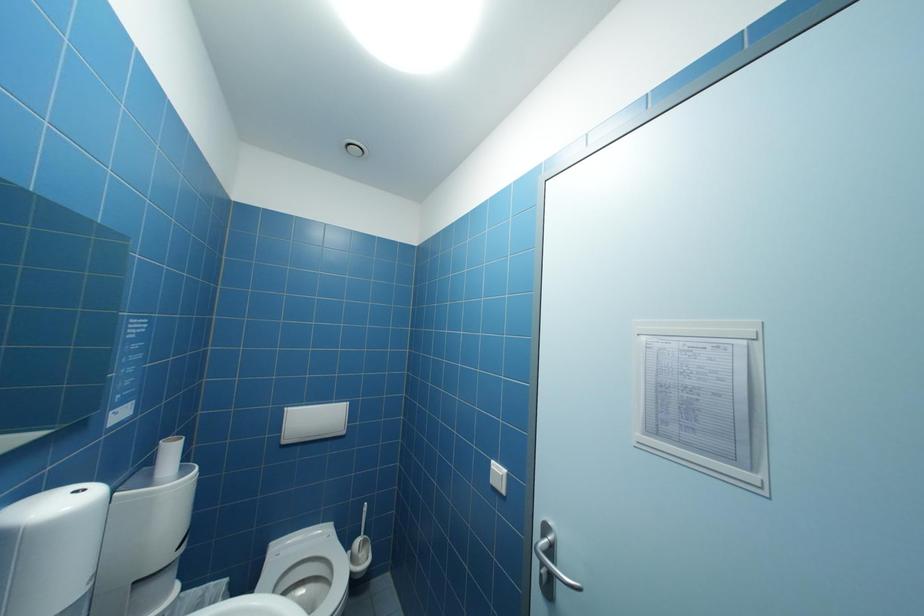
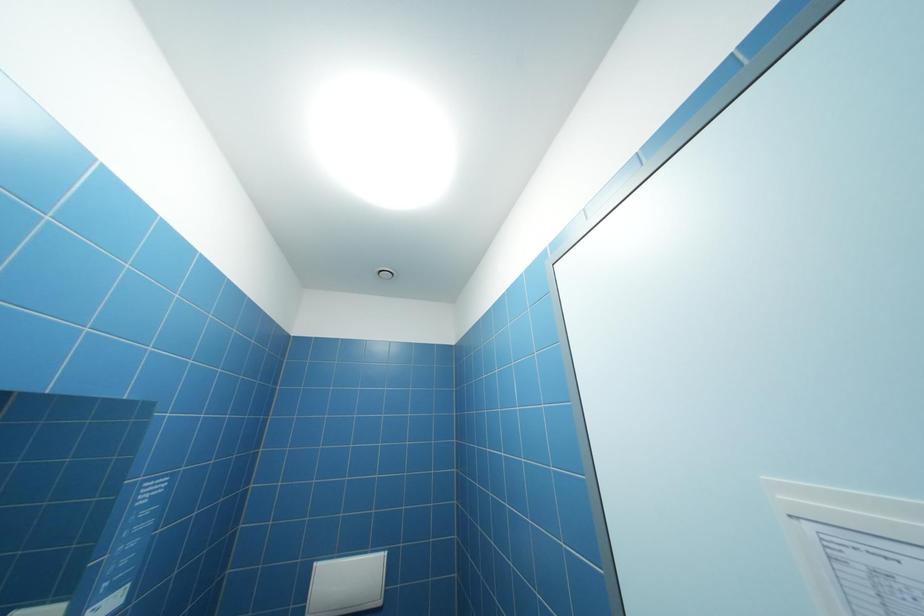
Question: Based on the continuous images, in which direction is the camera rotating? Reply with the corresponding letter.

Choices:
 (A) Left
 (B) Right
 (C) Up
 (D) Down

Answer: (C)